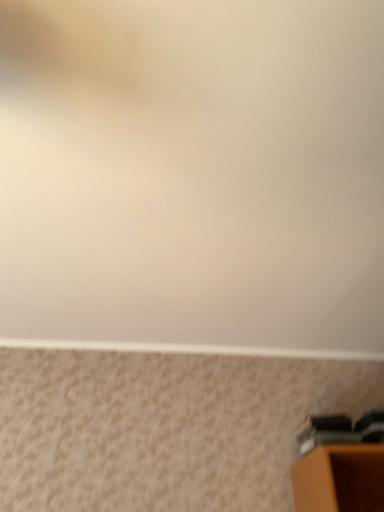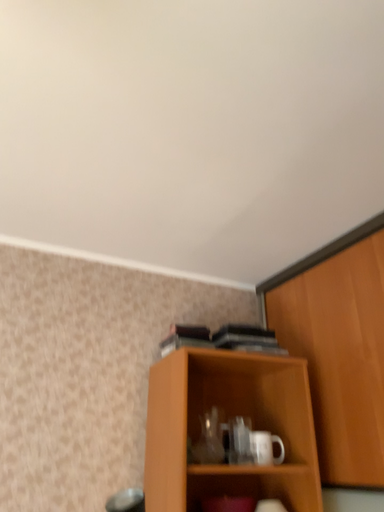
Question: Which way did the camera rotate in the video?

Choices:
 (A) rotated left
 (B) rotated right

Answer: (B)